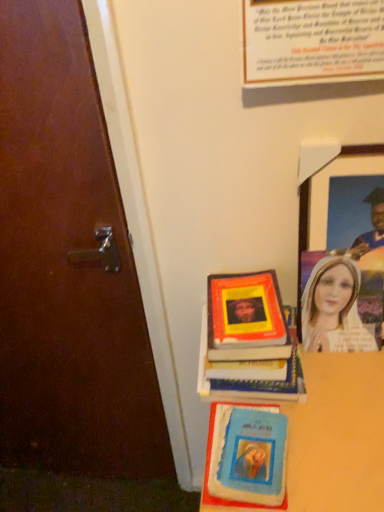
The width and height of the screenshot is (384, 512). Identify the location of free space that is in between hardcover book at center and wooden picture frame at upper right. (334, 373).